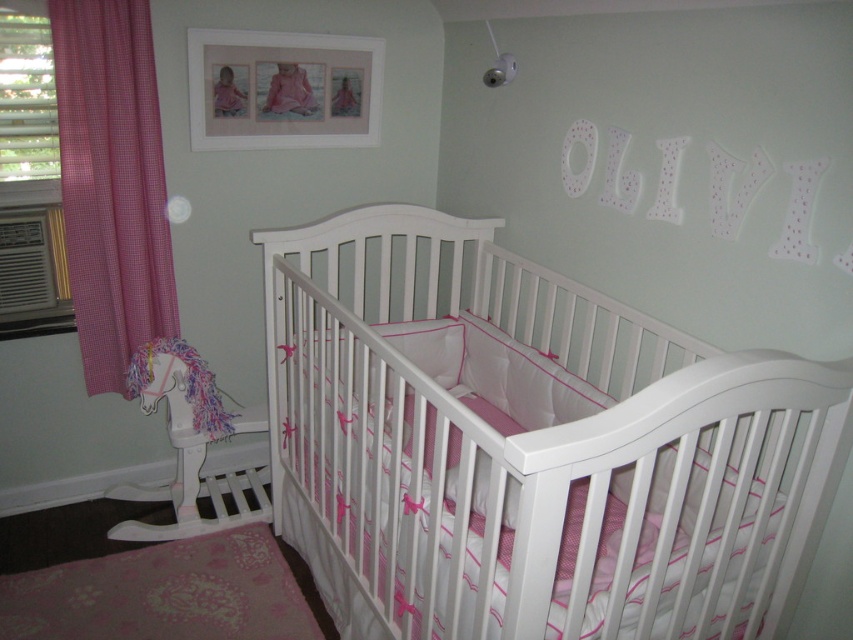
You are a parent standing in the nursery and want to hang a new mobile above the crib. The mobile requires a hook that must be placed exactly 2 meters away from the camera to ensure it hangs at the correct height. Can the existing white matte picture frame at upper center, which is currently hanging at 2.21 meters away from the camera, be used as a reference point for installing the hook?

The white matte picture frame at upper center is 2.21 meters away from the camera, which is 21 centimeters further away than the required 2 meters. Therefore, the existing frame cannot be used as a reference point for installing the hook since it is not positioned at the correct distance.

You are a parent looking at the nursery wall. You see the white matte picture frame at upper center and the pink fabric baby at upper center. Which object is positioned to the right side?

The white matte picture frame at upper center is to the right of the pink fabric baby at upper center.